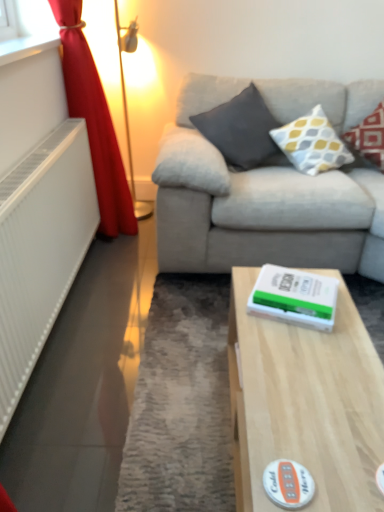
Question: Should I look upward or downward to see white textured pillow at upper right, placed as the 2th pillow when sorted from left to right?

Choices:
 (A) down
 (B) up

Answer: (B)

Question: From a real-world perspective, is light wood table at center positioned over white plastic radiator at left based on gravity?

Choices:
 (A) yes
 (B) no

Answer: (B)

Question: Is light wood table at center smaller than white plastic radiator at left?

Choices:
 (A) no
 (B) yes

Answer: (A)

Question: From a real-world perspective, is light wood table at center positioned under white plastic radiator at left based on gravity?

Choices:
 (A) no
 (B) yes

Answer: (B)

Question: Does light wood table at center have a greater height compared to white plastic radiator at left?

Choices:
 (A) yes
 (B) no

Answer: (B)

Question: Is light wood table at center with white plastic radiator at left?

Choices:
 (A) yes
 (B) no

Answer: (B)

Question: Would you say light wood table at center is outside white plastic radiator at left?

Choices:
 (A) no
 (B) yes

Answer: (B)

Question: Can you confirm if red velvet curtain at left is bigger than white matte sticker at lower center?

Choices:
 (A) no
 (B) yes

Answer: (B)

Question: Is red velvet curtain at left shorter than white matte sticker at lower center?

Choices:
 (A) no
 (B) yes

Answer: (A)

Question: From the image's perspective, is red velvet curtain at left located beneath white matte sticker at lower center?

Choices:
 (A) yes
 (B) no

Answer: (B)

Question: Is the position of red velvet curtain at left more distant than that of white matte sticker at lower center?

Choices:
 (A) yes
 (B) no

Answer: (A)

Question: Is red velvet curtain at left facing towards white matte sticker at lower center?

Choices:
 (A) yes
 (B) no

Answer: (B)

Question: From a real-world perspective, is red velvet curtain at left located beneath white matte sticker at lower center?

Choices:
 (A) yes
 (B) no

Answer: (B)

Question: Is light wood table at center shorter than white textured pillow at upper right, placed as the 2th pillow when sorted from left to right?

Choices:
 (A) no
 (B) yes

Answer: (B)